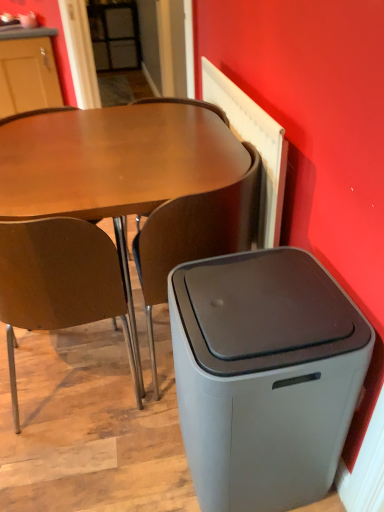
Question: From the image's perspective, is brown wood chair at left, which is the second chair in right-to-left order, positioned above or below gray matte trash bin/can at lower right?

Choices:
 (A) above
 (B) below

Answer: (A)

Question: From their relative heights in the image, would you say brown wood chair at left, which is the second chair in right-to-left order, is taller or shorter than gray matte trash bin/can at lower right?

Choices:
 (A) tall
 (B) short

Answer: (A)

Question: Which object is positioned farthest from the brown wood chair at left, which is the second chair in right-to-left order?

Choices:
 (A) matte brown desk at center
 (B) gray matte trash bin/can at lower right
 (C) brown matte chair at center, which is counted as the 2th chair, starting from the left

Answer: (B)

Question: Which object is positioned farthest from the matte brown desk at center?

Choices:
 (A) gray matte trash bin/can at lower right
 (B) brown wood chair at left, which is the second chair in right-to-left order
 (C) brown matte chair at center, the first chair positioned from the right

Answer: (A)